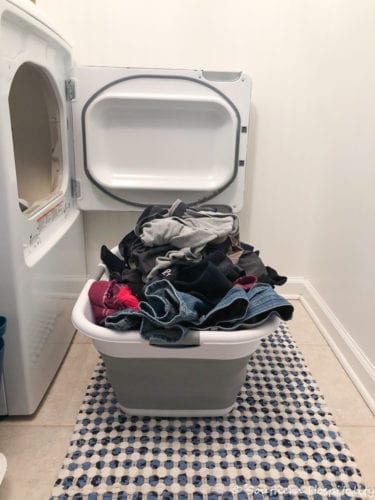
Find the location of a particular element. This screenshot has width=375, height=500. openings in dryer door where latch mechanism fits is located at coordinates (244, 130), (242, 164).